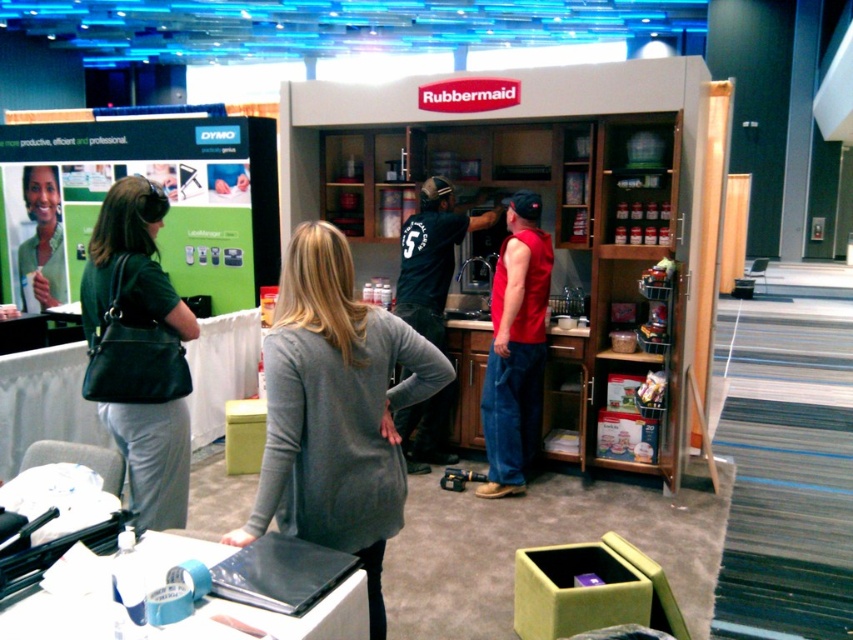
You are at the Rubbermaid booth and need to place a new product catalog. The catalog is taller than the green matte shirt at upper left. Can the black leather purse at left hold it?

The black leather purse at left is taller than the green matte shirt at upper left. Since the catalog is also taller than the green matte shirt at upper left, it might fit in the black leather purse at left, but the exact dimensions of the catalog and purse aren